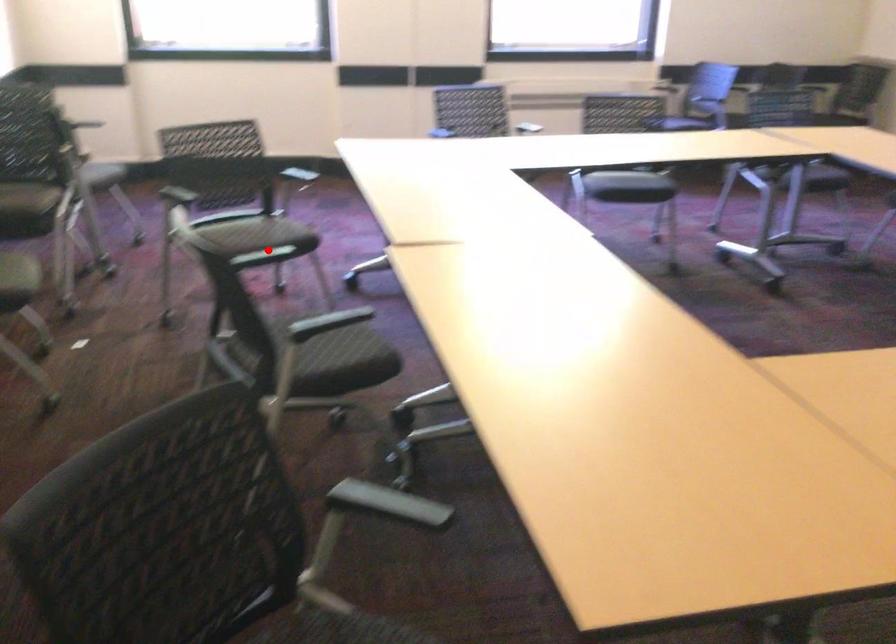
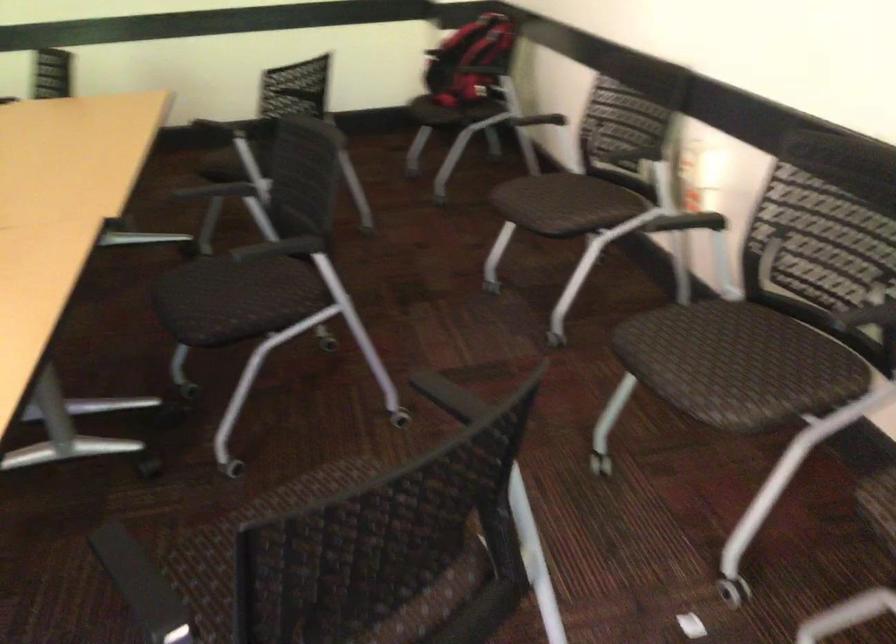
Question: I am providing you with two images of the same scene from different viewpoints. Image1 has a red point marked. In image2, the corresponding 3D location appears at what relative position? Reply with the corresponding letter.

Choices:
 (A) Closer
 (B) Farther

Answer: (A)